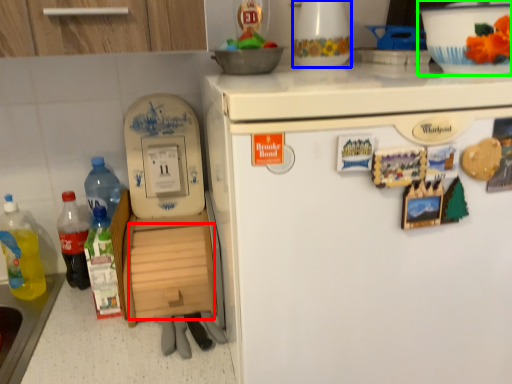
Question: Which object is positioned farthest from drawer (highlighted by a red box)? Select from appliance (highlighted by a blue box) and bowl (highlighted by a green box).

Choices:
 (A) appliance
 (B) bowl

Answer: (B)